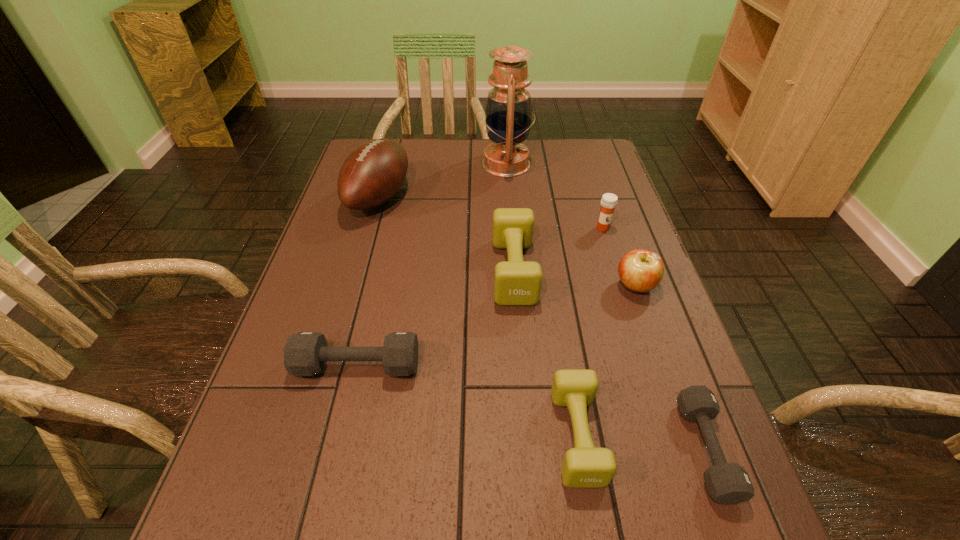
Image resolution: width=960 pixels, height=540 pixels. Find the location of `vacant point located between the third nearest dumbbell and the apple`. vacant point located between the third nearest dumbbell and the apple is located at coordinates (496, 326).

I want to click on free space between the oil lamp and the medicine, so click(555, 196).

I want to click on unoccupied area between the apple and the tallest object, so click(x=571, y=225).

Locate which object ranks sixth in proximity to the shortest object. Please provide its 2D coordinates. Your answer should be formatted as a tuple, i.e. [(x, y)], where the tuple contains the x and y coordinates of a point satisfying the conditions above.

[(508, 113)]

Select which object is the fifth closest to the second dumbbell from right to left. Please provide its 2D coordinates. Your answer should be formatted as a tuple, i.e. [(x, y)], where the tuple contains the x and y coordinates of a point satisfying the conditions above.

[(608, 202)]

At what (x,y) coordinates should I click in order to perform the action: click on dumbbell that can be found as the third closest to the nearer olive dumbbell. Please return your answer as a coordinate pair (x, y). The height and width of the screenshot is (540, 960). Looking at the image, I should click on (305, 353).

Identify which dumbbell is located as the fourth nearest to the oil lamp. Please provide its 2D coordinates. Your answer should be formatted as a tuple, i.e. [(x, y)], where the tuple contains the x and y coordinates of a point satisfying the conditions above.

[(728, 483)]

I want to click on vacant space that satisfies the following two spatial constraints: 1. on the label side of the apple; 2. on the right side of the medicine, so click(x=621, y=287).

At what (x,y) coordinates should I click in order to perform the action: click on vacant space that satisfies the following two spatial constraints: 1. on the label side of the medicine; 2. on the left side of the smaller gray dumbbell. Please return your answer as a coordinate pair (x, y). Looking at the image, I should click on (672, 449).

At what (x,y) coordinates should I click in order to perform the action: click on vacant space that satisfies the following two spatial constraints: 1. on the front side of the smaller gray dumbbell; 2. on the right side of the apple. Please return your answer as a coordinate pair (x, y). The width and height of the screenshot is (960, 540). Looking at the image, I should click on (692, 449).